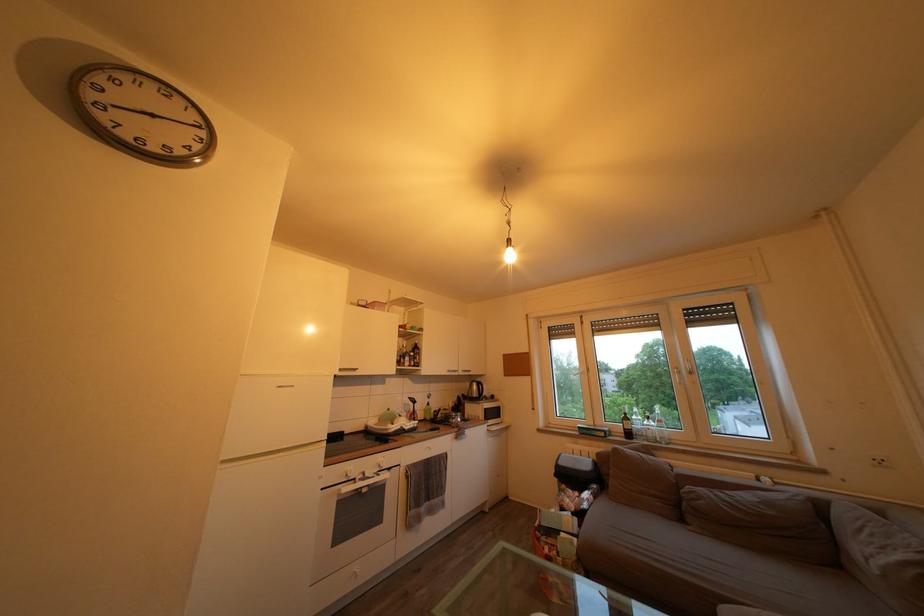
The height and width of the screenshot is (616, 924). Describe the element at coordinates (435, 415) in the screenshot. I see `a faucet handle` at that location.